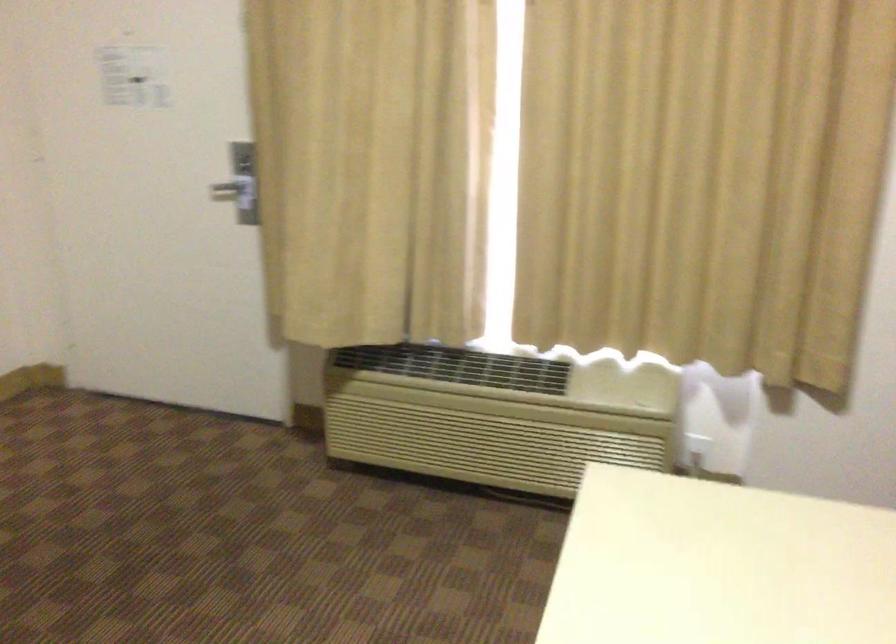
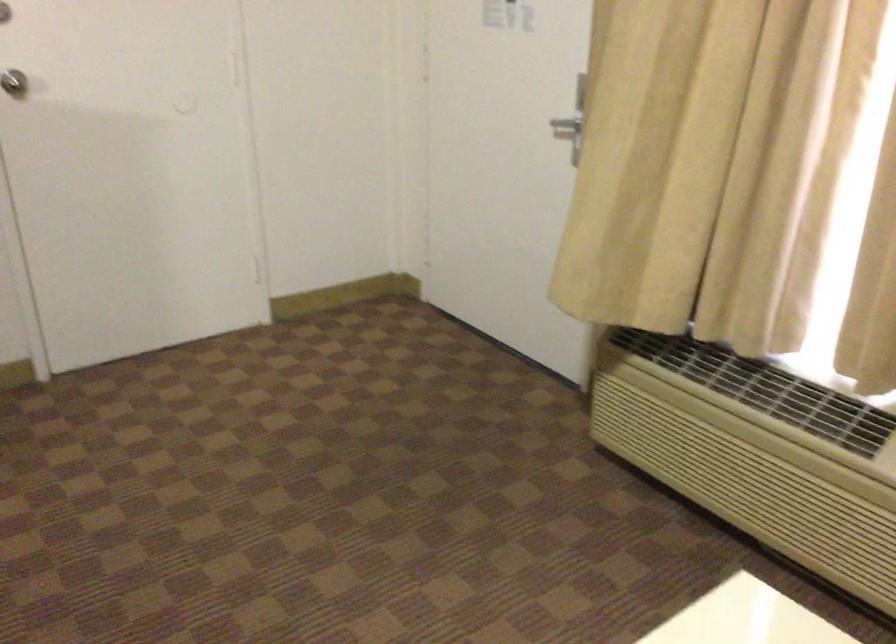
Question: The camera is either moving clockwise (left) or counter-clockwise (right) around the object. The first image is from the beginning of the video and the second image is from the end. Is the camera moving left or right when shooting the video?

Choices:
 (A) Left
 (B) Right

Answer: (B)